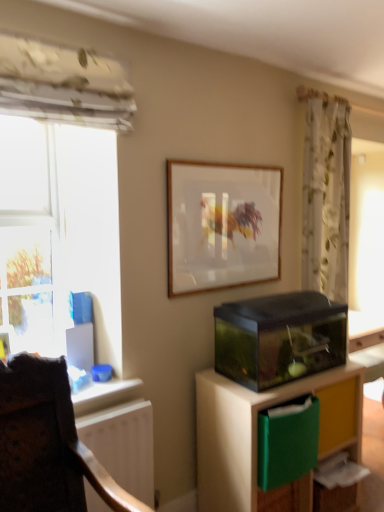
Question: Is transparent glass aquarium at lower right at the left side of white matte radiator at lower left?

Choices:
 (A) no
 (B) yes

Answer: (A)

Question: Can you confirm if transparent glass aquarium at lower right is shorter than white matte radiator at lower left?

Choices:
 (A) no
 (B) yes

Answer: (A)

Question: From a real-world perspective, is transparent glass aquarium at lower right physically above white matte radiator at lower left?

Choices:
 (A) no
 (B) yes

Answer: (A)

Question: Is white matte radiator at lower left located within transparent glass aquarium at lower right?

Choices:
 (A) no
 (B) yes

Answer: (A)

Question: From the image's perspective, is transparent glass aquarium at lower right below white matte radiator at lower left?

Choices:
 (A) yes
 (B) no

Answer: (A)

Question: From the image's perspective, relative to transparent glass aquarium at lower right, is transparent glass window at left above or below?

Choices:
 (A) below
 (B) above

Answer: (B)

Question: From a real-world perspective, is transparent glass window at left positioned above or below transparent glass aquarium at lower right?

Choices:
 (A) above
 (B) below

Answer: (A)

Question: Is transparent glass window at left bigger or smaller than transparent glass aquarium at lower right?

Choices:
 (A) small
 (B) big

Answer: (A)

Question: Considering the positions of transparent glass window at left and transparent glass aquarium at lower right in the image, is transparent glass window at left wider or thinner than transparent glass aquarium at lower right?

Choices:
 (A) wide
 (B) thin

Answer: (B)

Question: From the image's perspective, relative to transparent glass aquarium at lower right, is velvet dark brown chair at lower left above or below?

Choices:
 (A) above
 (B) below

Answer: (B)

Question: Considering their positions, is velvet dark brown chair at lower left located in front of or behind transparent glass aquarium at lower right?

Choices:
 (A) front
 (B) behind

Answer: (A)

Question: Is point (34, 369) positioned closer to the camera than point (286, 325)?

Choices:
 (A) closer
 (B) farther

Answer: (A)

Question: Would you say velvet dark brown chair at lower left is inside or outside transparent glass aquarium at lower right?

Choices:
 (A) outside
 (B) inside

Answer: (A)

Question: From a real-world perspective, relative to wooden frame at upper center, is velvet dark brown chair at lower left vertically above or below?

Choices:
 (A) above
 (B) below

Answer: (B)

Question: Is velvet dark brown chair at lower left wider or thinner than wooden frame at upper center?

Choices:
 (A) thin
 (B) wide

Answer: (B)